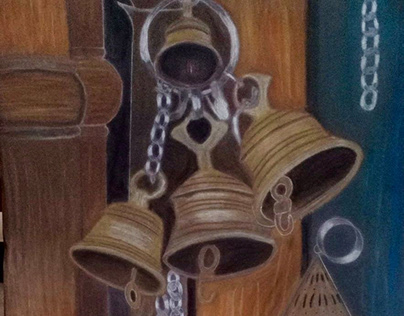
At what (x,y) coordinates should I click in order to perform the action: click on gap in door. Please return your answer as a coordinate pair (x, y). Looking at the image, I should click on (122, 43).